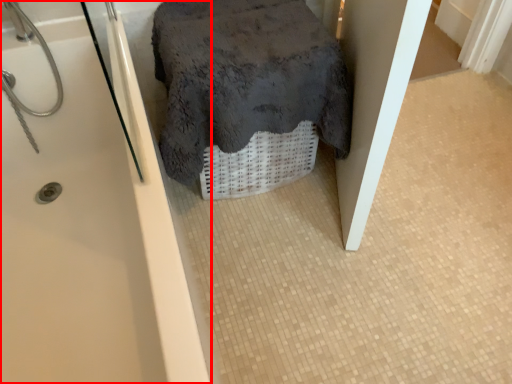
Question: From the image's perspective, what is the correct spatial relationship of bathtub (annotated by the red box) in relation to bath towel?

Choices:
 (A) below
 (B) above

Answer: (A)